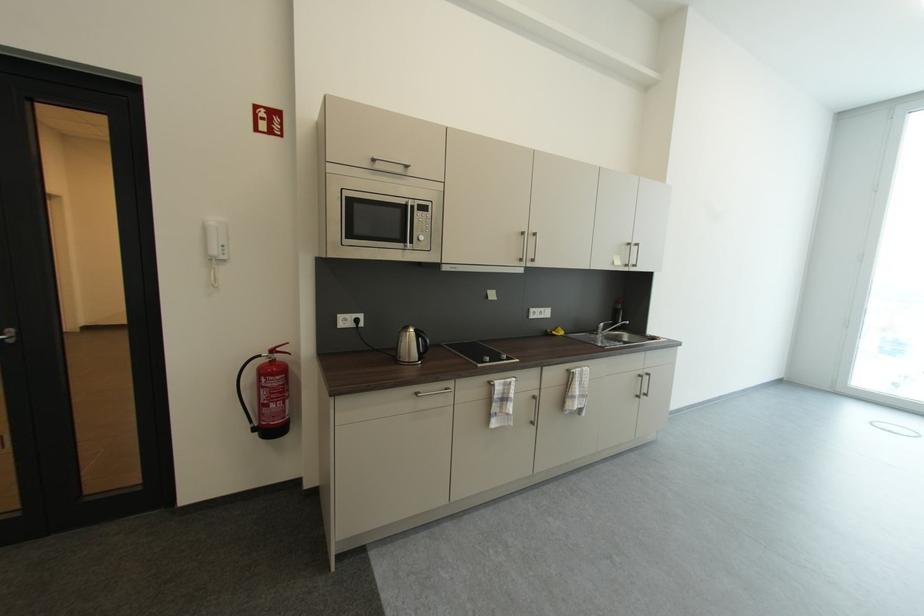
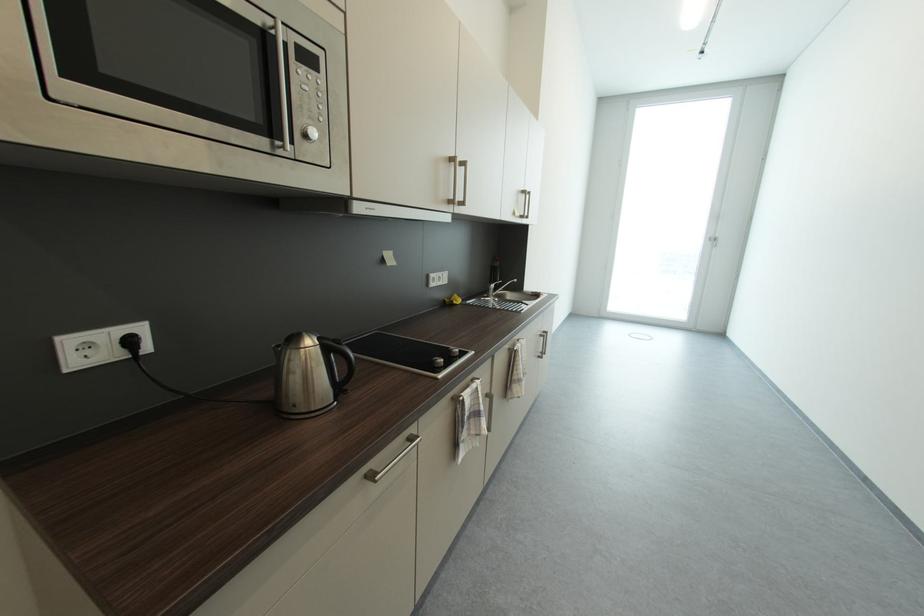
The point at (502, 398) is marked in the first image. Where is the corresponding point in the second image?

(472, 419)